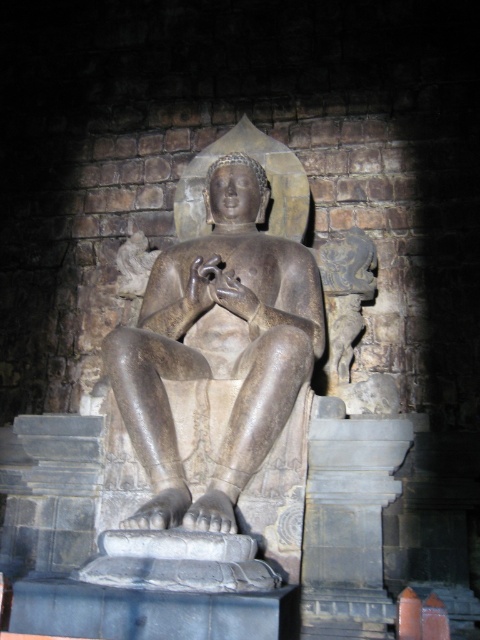
Measure the distance between polished stone statue at center and gray stone pedestal at center.

The distance of polished stone statue at center from gray stone pedestal at center is 6.61 meters.

This screenshot has height=640, width=480. Describe the element at coordinates (217, 346) in the screenshot. I see `polished stone statue at center` at that location.

At what (x,y) coordinates should I click in order to perform the action: click on polished stone statue at center. Please return your answer as a coordinate pair (x, y). The width and height of the screenshot is (480, 640). Looking at the image, I should click on (217, 346).

Identify the location of polished stone statue at center. (217, 346).